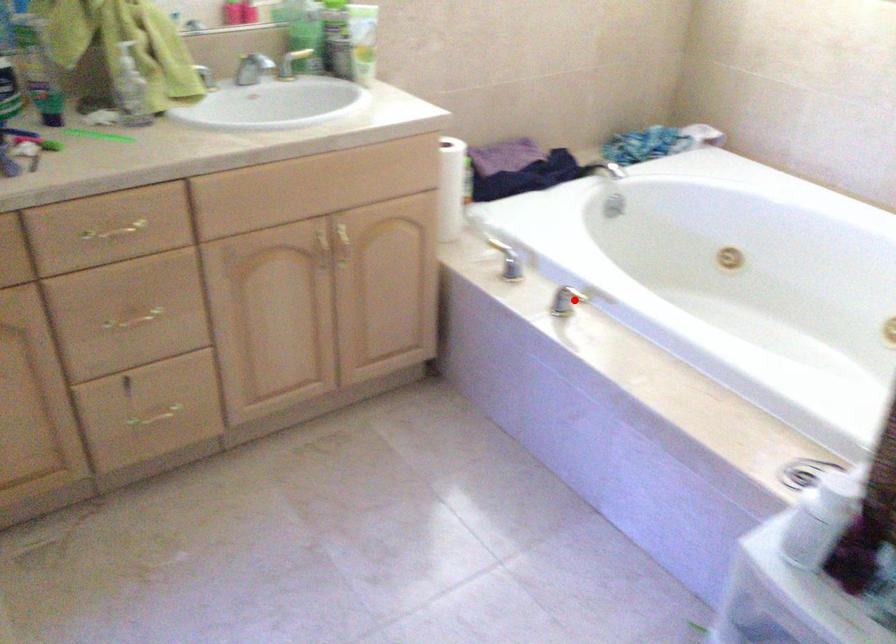
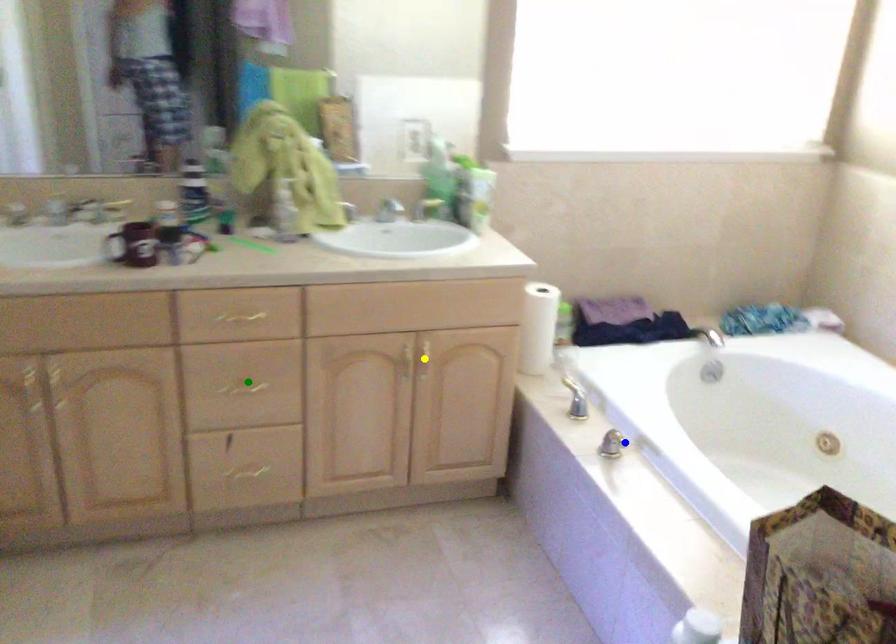
Question: I am providing you with two images of the same scene from different viewpoints. A red point is marked on the first image. You are given multiple points on the second image. Which spot in image 2 lines up with the point in image 1?

Choices:
 (A) green point
 (B) yellow point
 (C) blue point

Answer: (C)